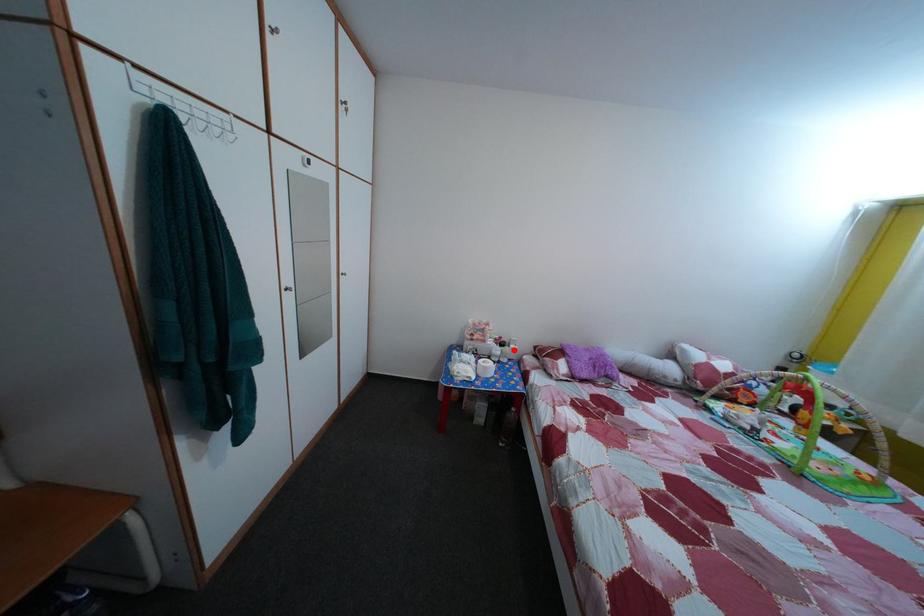
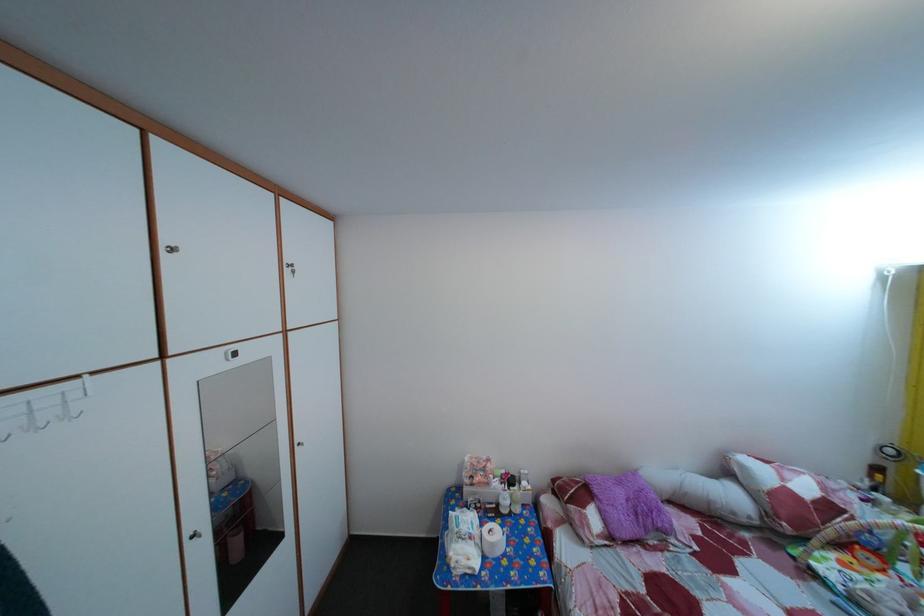
The point at the highlighted location is marked in the first image. Where is the corresponding point in the second image?

(524, 485)